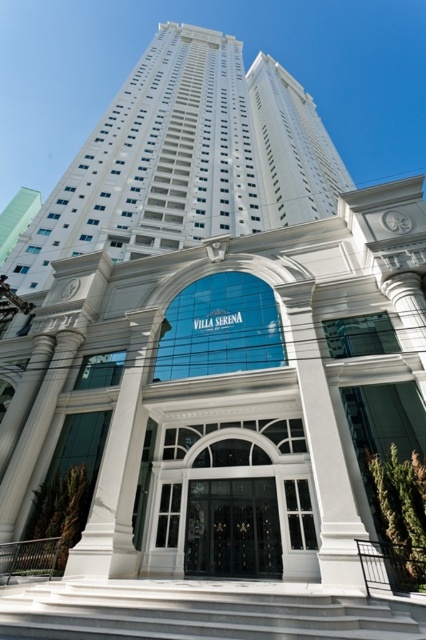
Question: Which object appears closest to the camera in this image?

Choices:
 (A) white smooth building at upper center
 (B) black glass door at center

Answer: (B)

Question: Can you confirm if white smooth building at upper center is positioned to the left of black glass door at center?

Choices:
 (A) no
 (B) yes

Answer: (A)

Question: Which of the following is the farthest from the observer?

Choices:
 (A) white smooth building at upper center
 (B) black glass door at center

Answer: (A)

Question: Which object appears farthest from the camera in this image?

Choices:
 (A) black glass door at center
 (B) white smooth building at upper center

Answer: (B)

Question: Can you confirm if white smooth building at upper center is bigger than black glass door at center?

Choices:
 (A) no
 (B) yes

Answer: (B)

Question: Does white smooth building at upper center appear under black glass door at center?

Choices:
 (A) no
 (B) yes

Answer: (A)